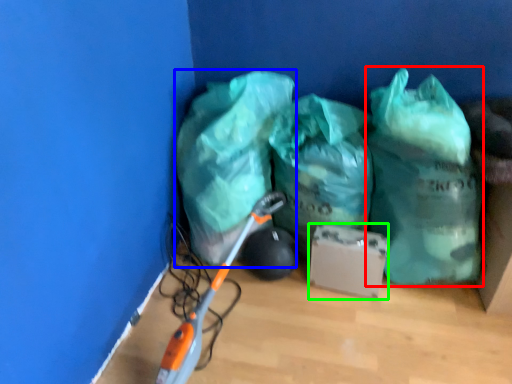
Question: Estimate the real-world distances between objects in this image. Which object is farther from plastic bag (highlighted by a red box), plastic bag (highlighted by a blue box) or cardboard box (highlighted by a green box)?

Choices:
 (A) plastic bag
 (B) cardboard box

Answer: (A)